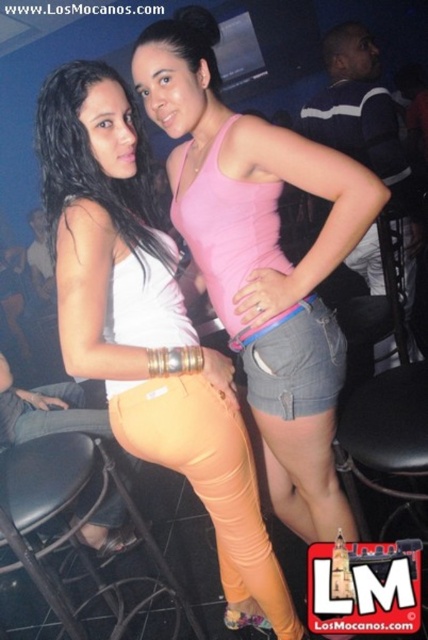
You are standing in a dimly lit bar and see the matte white tank top at center. Where exactly is it located in terms of coordinates?

The matte white tank top at center is located at coordinates point (x=148, y=328).

You are a photographer trying to capture a closeup shot of both the matte white tank top at center and the pink matte tank top at center in the image. Given that your camera can only focus on objects within 8 inches of each other, will you be able to get both in focus?

The distance between the matte white tank top at center and the pink matte tank top at center is 8.79 inches, which exceeds the 8 inch focus range. Therefore, you cannot get both in focus at the same time.